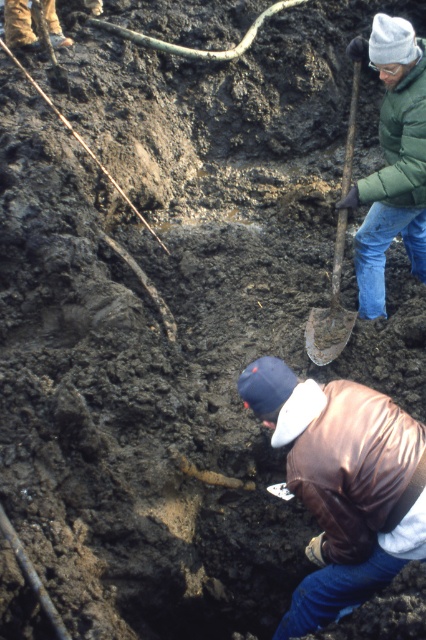
You are an archaeologist at the excavation site. You need to locate the brown leather jacket at lower center. What are the coordinates where you should look?

The brown leather jacket at lower center is located at coordinates point (351, 465).

You are an archaeologist at the excavation site. You need to hand the rusty metal shovel at upper right to the person wearing the green puffy jacket at upper right. Can you reach them without moving from your current position?

The green puffy jacket at upper right has a larger size compared to rusty metal shovel at upper right, so yes, you can reach the person wearing the green puffy jacket at upper right to hand them the rusty metal shovel at upper right.

You are standing at the point marked as point (351, 465) in the image. What object is located exactly at this point?

The point (351, 465) corresponds to the brown leather jacket at lower center.